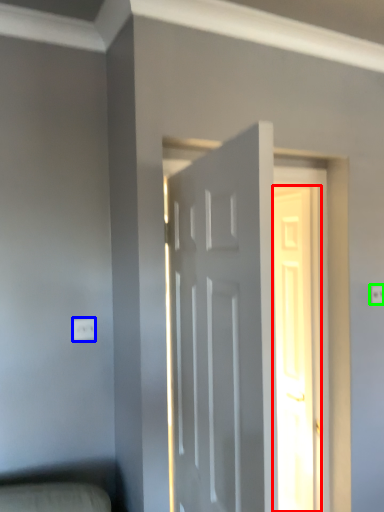
Question: Which object is the closest to the door (highlighted by a red box)? Choose among these: electric outlet (highlighted by a blue box) or electric outlet (highlighted by a green box).

Choices:
 (A) electric outlet
 (B) electric outlet

Answer: (B)